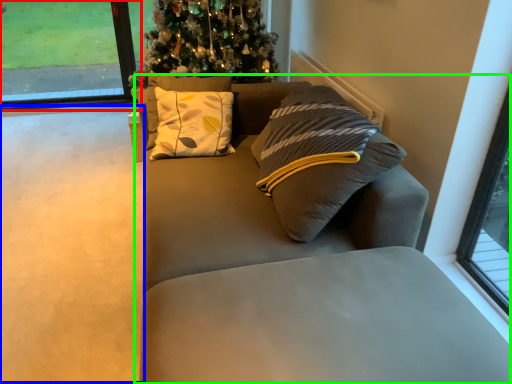
Question: Which object is the farthest from window (highlighted by a red box)? Choose among these: golf course (highlighted by a blue box) or studio couch (highlighted by a green box).

Choices:
 (A) golf course
 (B) studio couch

Answer: (B)